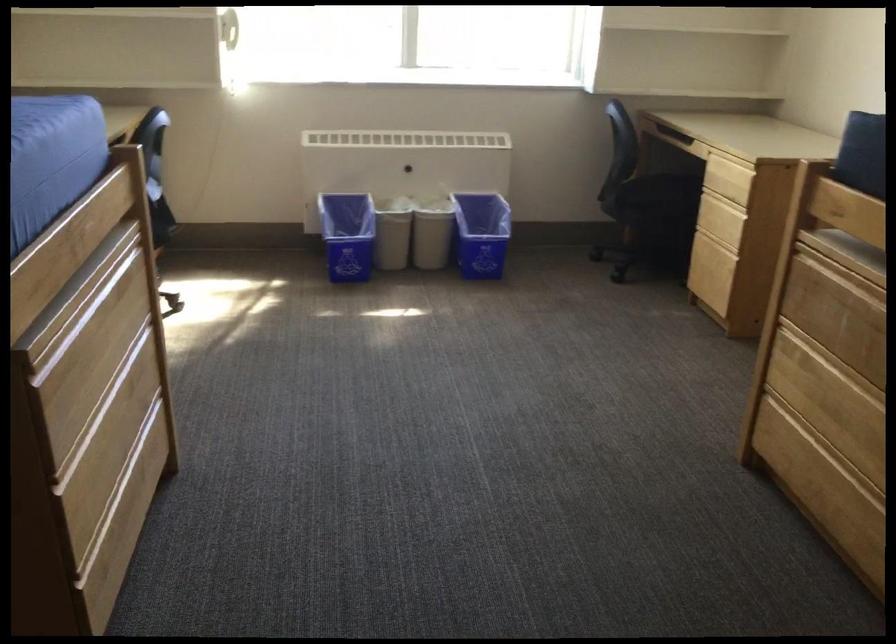
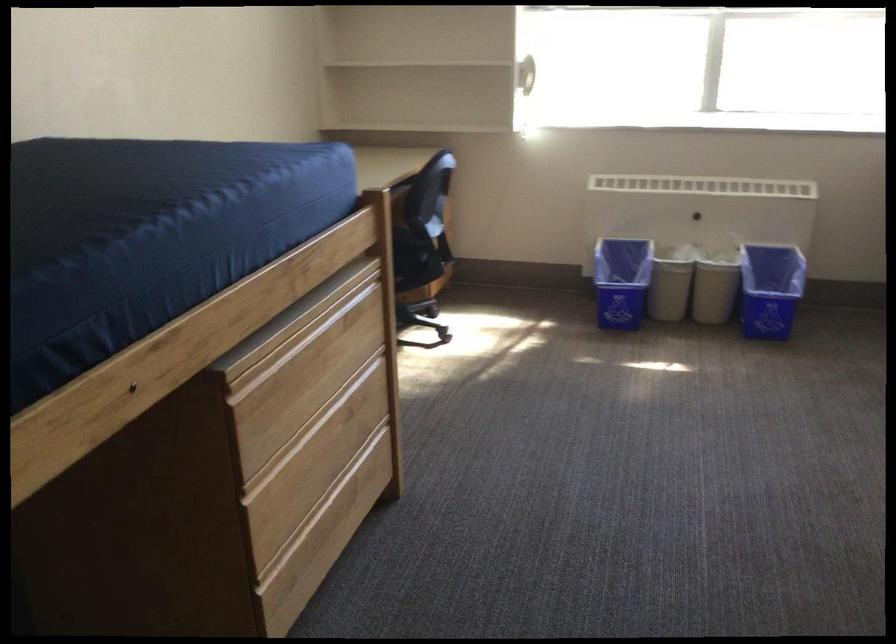
The point at (82,321) is marked in the first image. Where is the corresponding point in the second image?

(296, 346)